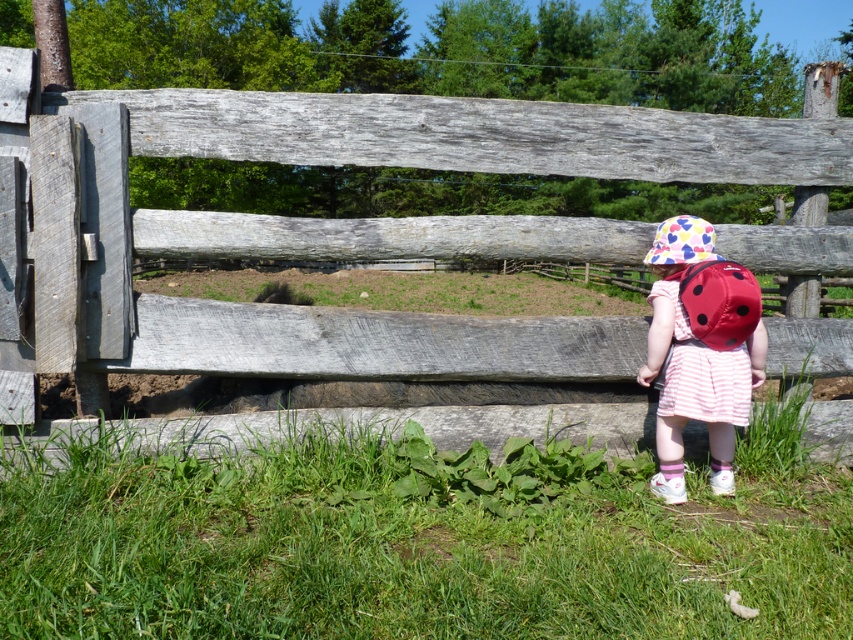
Question: Which point appears closest to the camera in this image?

Choices:
 (A) (91, 374)
 (B) (693, 272)
 (C) (636, 572)
 (D) (689, 220)

Answer: (C)

Question: Which point is closer to the camera taking this photo?

Choices:
 (A) (650, 262)
 (B) (668, 241)
 (C) (721, 344)
 (D) (306, 467)

Answer: (C)

Question: Which object is farther from the camera taking this photo?

Choices:
 (A) green grass at lower center
 (B) multicolored fabric hat at center
 (C) polka dot fabric hat at center
 (D) weathered wood fence at center

Answer: (B)

Question: Is green grass at lower center bigger than red matte backpack at center?

Choices:
 (A) no
 (B) yes

Answer: (B)

Question: Does polka dot fabric hat at center have a larger size compared to multicolored fabric hat at center?

Choices:
 (A) no
 (B) yes

Answer: (B)

Question: Can you confirm if green grass at lower center is positioned to the right of red matte backpack at center?

Choices:
 (A) yes
 (B) no

Answer: (B)